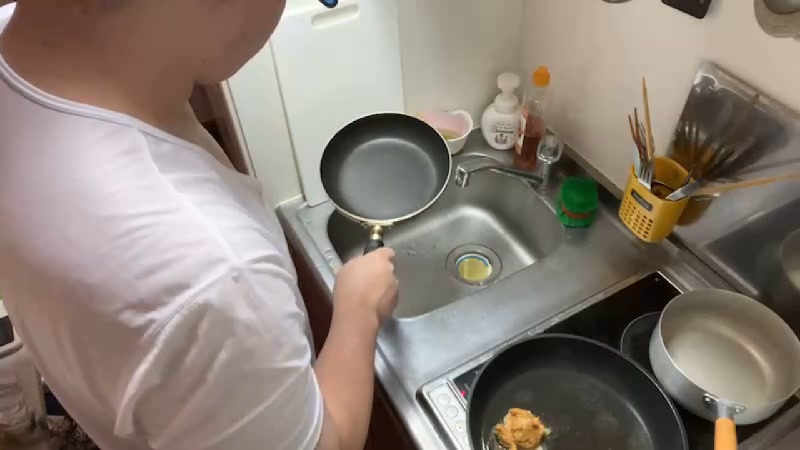
Where is `holder`? Image resolution: width=800 pixels, height=450 pixels. holder is located at coordinates (650, 202).